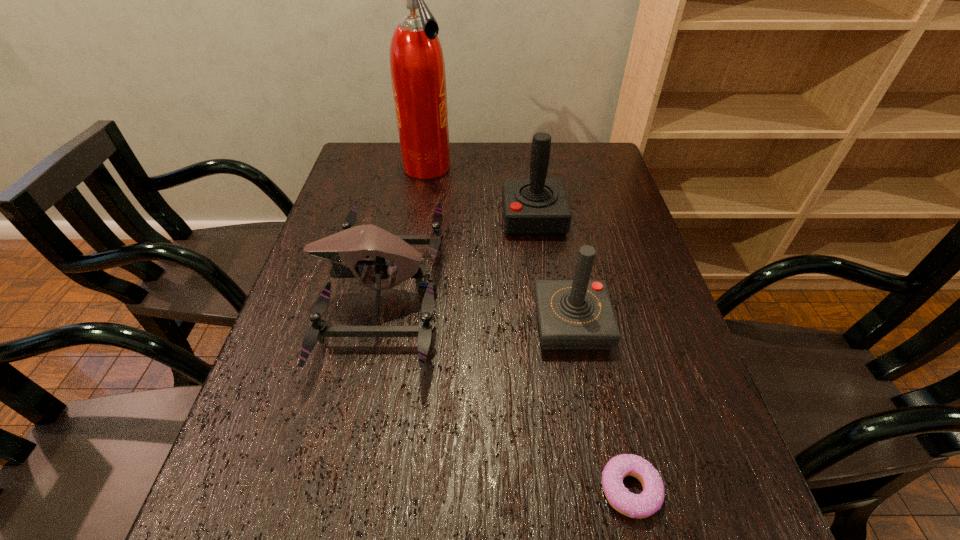
Locate an element on the screen. Image resolution: width=960 pixels, height=540 pixels. fire extinguisher is located at coordinates (417, 66).

I want to click on the tallest object, so click(417, 66).

The image size is (960, 540). Identify the location of the farther joystick. (537, 206).

Where is `the shorter joystick`? the shorter joystick is located at coordinates (577, 314).

This screenshot has height=540, width=960. Identify the location of the nearer joystick. (577, 314).

You are a GUI agent. You are given a task and a screenshot of the screen. Output one action in this format:
    pyautogui.click(x=<x>, y=<y>)
    Task: Click on the drone
    The image size is (960, 540).
    Given the screenshot: What is the action you would take?
    pyautogui.click(x=345, y=249)

I want to click on doughnut, so click(643, 505).

This screenshot has height=540, width=960. I want to click on the nearest object, so click(x=643, y=505).

Identify the location of free location located on the right of the farthest object. This screenshot has width=960, height=540. (523, 169).

Locate an element on the screen. vacant space located on the base of the farther joystick is located at coordinates [x=376, y=218].